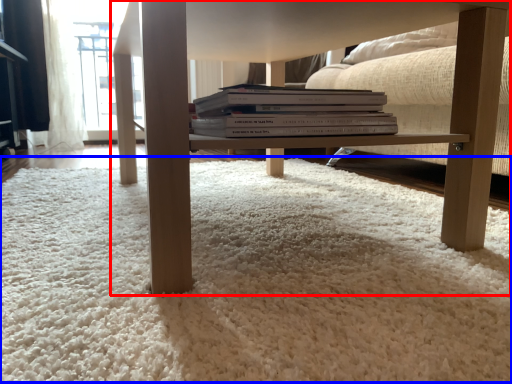
Question: Which object is further to the camera taking this photo, table (highlighted by a red box) or plain (highlighted by a blue box)?

Choices:
 (A) table
 (B) plain

Answer: (A)